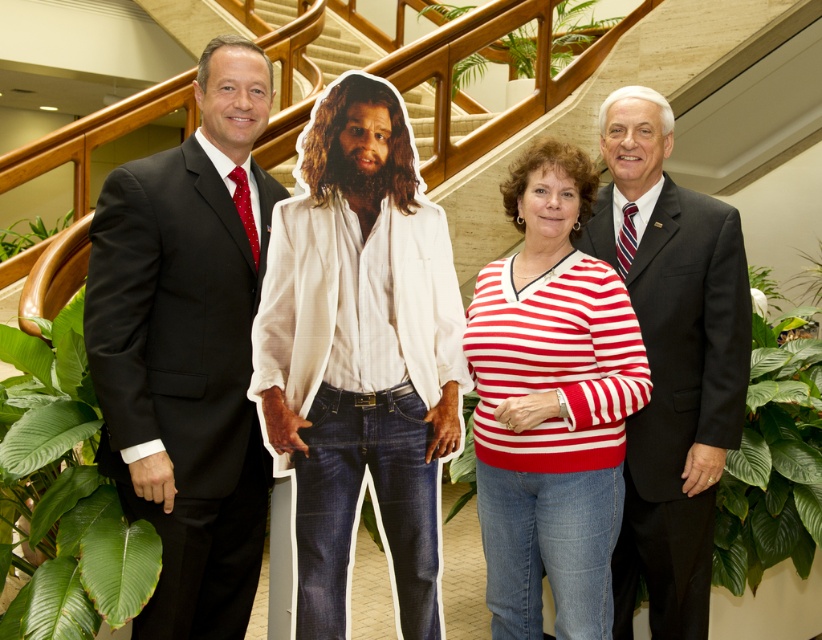
Question: Based on their relative distances, which object is nearer to the matte black suit at left?

Choices:
 (A) striped knit sweater at center
 (B) green leafy plant at lower left
 (C) green leafy plant at lower center

Answer: (B)

Question: Is striped knit sweater at center wider than green leafy plant at lower center?

Choices:
 (A) no
 (B) yes

Answer: (B)

Question: Does green leafy plant at lower left have a larger size compared to green leafy plant at lower center?

Choices:
 (A) no
 (B) yes

Answer: (B)

Question: Which object is the farthest from the striped knit sweater at center?

Choices:
 (A) green leafy plant at right
 (B) white cotton shirt at center

Answer: (A)

Question: Which point is farther to the camera?

Choices:
 (A) green leafy plant at right
 (B) striped knit sweater at center
 (C) green leafy plant at upper center
 (D) green leafy plant at left

Answer: (C)

Question: Is white cotton shirt at center smaller than matte black suit at right?

Choices:
 (A) no
 (B) yes

Answer: (B)